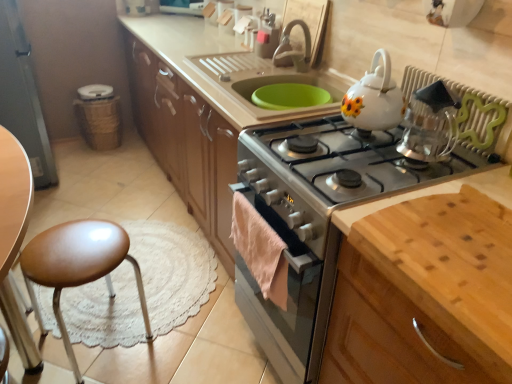
Question: Does silver metallic gas stove at center have a lesser height compared to light brown wood cutting board at lower right?

Choices:
 (A) yes
 (B) no

Answer: (A)

Question: Does silver metallic gas stove at center lie behind light brown wood cutting board at lower right?

Choices:
 (A) yes
 (B) no

Answer: (A)

Question: Does silver metallic gas stove at center appear on the left side of light brown wood cutting board at lower right?

Choices:
 (A) no
 (B) yes

Answer: (B)

Question: From the image's perspective, is silver metallic gas stove at center located beneath light brown wood cutting board at lower right?

Choices:
 (A) yes
 (B) no

Answer: (B)

Question: Can we say silver metallic gas stove at center lies outside light brown wood cutting board at lower right?

Choices:
 (A) no
 (B) yes

Answer: (B)

Question: Considering the positions of silver metallic gas stove at center and silver metallic faucet at upper center in the image, is silver metallic gas stove at center bigger or smaller than silver metallic faucet at upper center?

Choices:
 (A) small
 (B) big

Answer: (B)

Question: Is silver metallic gas stove at center in front of or behind silver metallic faucet at upper center in the image?

Choices:
 (A) behind
 (B) front

Answer: (B)

Question: Considering the relative positions of silver metallic gas stove at center and silver metallic faucet at upper center in the image provided, is silver metallic gas stove at center to the left or to the right of silver metallic faucet at upper center?

Choices:
 (A) left
 (B) right

Answer: (B)

Question: Is silver metallic gas stove at center inside or outside of silver metallic faucet at upper center?

Choices:
 (A) outside
 (B) inside

Answer: (A)

Question: Is white glossy teapot at upper right to the left or to the right of brown leather stool at lower left in the image?

Choices:
 (A) right
 (B) left

Answer: (A)

Question: Does point (385, 89) appear closer or farther from the camera than point (55, 264)?

Choices:
 (A) farther
 (B) closer

Answer: (B)

Question: Is white glossy teapot at upper right situated inside brown leather stool at lower left or outside?

Choices:
 (A) outside
 (B) inside

Answer: (A)

Question: In terms of height, does white glossy teapot at upper right look taller or shorter compared to brown leather stool at lower left?

Choices:
 (A) short
 (B) tall

Answer: (A)

Question: From a real-world perspective, is brown leather stool at lower left physically located above or below silver metallic faucet at upper center?

Choices:
 (A) below
 (B) above

Answer: (A)

Question: Relative to silver metallic faucet at upper center, is brown leather stool at lower left in front or behind?

Choices:
 (A) front
 (B) behind

Answer: (A)